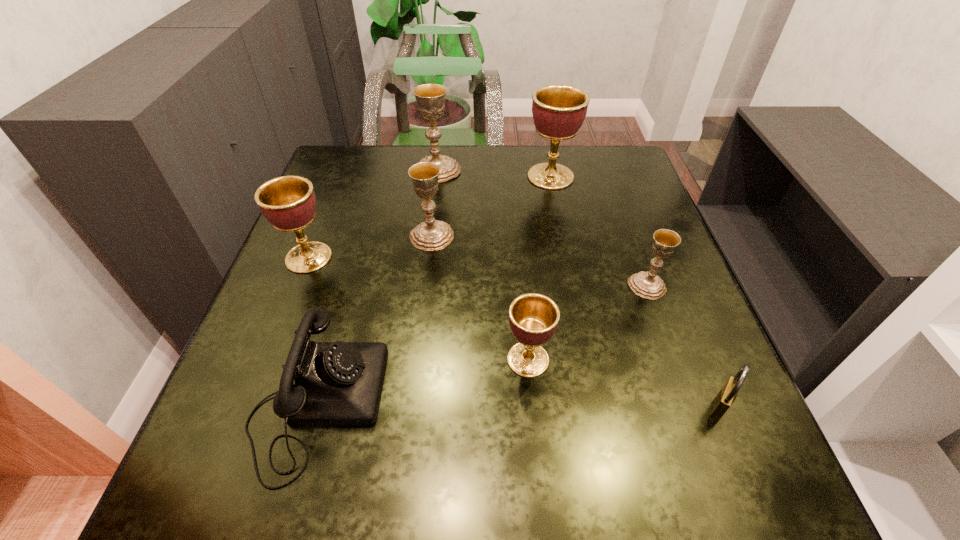
Identify the location of vacant point at the near right corner. (676, 463).

The height and width of the screenshot is (540, 960). What are the coordinates of `free space between the rightmost chalice and the padlock` in the screenshot? It's located at (683, 347).

You are a GUI agent. You are given a task and a screenshot of the screen. Output one action in this format:
    pyautogui.click(x=<x>, y=<y>)
    Task: Click on the vacant space that's between the telephone and the nearest gold chalice
    The image size is (960, 540).
    Given the screenshot: What is the action you would take?
    pyautogui.click(x=482, y=345)

Identify the location of free space between the nearest chalice and the telephone. This screenshot has height=540, width=960. (422, 381).

This screenshot has width=960, height=540. I want to click on free space between the telephone and the biggest golden chalice, so click(434, 289).

Locate an element on the screen. The height and width of the screenshot is (540, 960). vacant area between the telephone and the farthest gold chalice is located at coordinates [x=377, y=286].

Where is `free space between the second farthest golden chalice and the second nearest gold chalice`? This screenshot has width=960, height=540. free space between the second farthest golden chalice and the second nearest gold chalice is located at coordinates (370, 247).

Locate an element on the screen. The height and width of the screenshot is (540, 960). empty space that is in between the nearest gold chalice and the biggest gold chalice is located at coordinates (542, 228).

You are a GUI agent. You are given a task and a screenshot of the screen. Output one action in this format:
    pyautogui.click(x=<x>, y=<y>)
    Task: Click on the vacant region between the telephone and the second smallest gold chalice
    This screenshot has height=540, width=960.
    Given the screenshot: What is the action you would take?
    pyautogui.click(x=374, y=319)

The width and height of the screenshot is (960, 540). In order to click on vacant area that lies between the padlock and the second biggest gold chalice in this screenshot , I will do `click(575, 322)`.